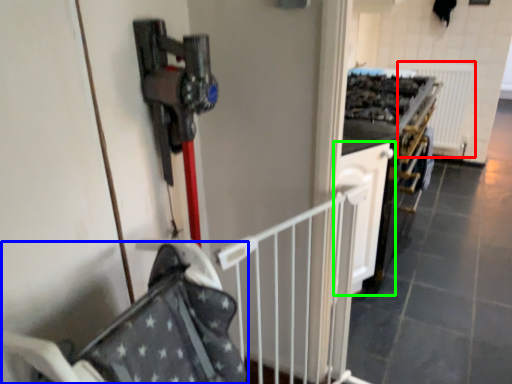
Question: Which object is the farthest from radiator (highlighted by a red box)? Choose among these: baby carriage (highlighted by a blue box) or cabinetry (highlighted by a green box).

Choices:
 (A) baby carriage
 (B) cabinetry

Answer: (A)